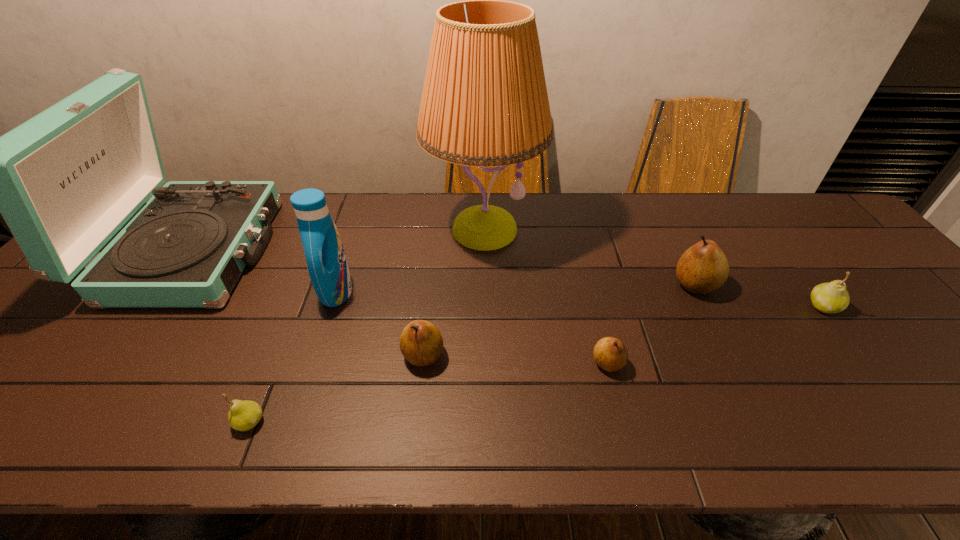
Locate an element on the screen. This screenshot has width=960, height=540. beige lamp is located at coordinates (484, 103).

The width and height of the screenshot is (960, 540). I want to click on lamp, so click(484, 103).

At what (x,y) coordinates should I click in order to perform the action: click on the leftmost object. Please return your answer as a coordinate pair (x, y). The image size is (960, 540). Looking at the image, I should click on (65, 181).

Where is `record player`? This screenshot has height=540, width=960. record player is located at coordinates (65, 181).

Find the location of a particular element. The width and height of the screenshot is (960, 540). the third object from left to right is located at coordinates (328, 269).

You are a GUI agent. You are given a task and a screenshot of the screen. Output one action in this format:
    pyautogui.click(x=<x>, y=<y>)
    Task: Click on the sixth shortest object
    The image size is (960, 540).
    Given the screenshot: What is the action you would take?
    pyautogui.click(x=328, y=269)

Where is `the second object from right to left`? the second object from right to left is located at coordinates (703, 268).

I want to click on the rightmost brown pear, so click(x=703, y=268).

I want to click on the farther green pear, so click(832, 297).

The height and width of the screenshot is (540, 960). What are the coordinates of `the rightmost object` in the screenshot? It's located at (832, 297).